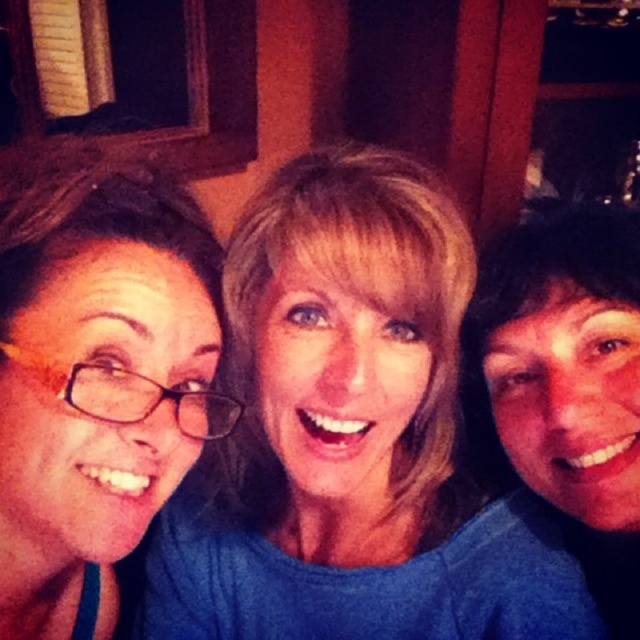
Based on the photo, can you confirm if yellow-framed glasses at left is smaller than matte blue shirt at center?

Indeed, yellow-framed glasses at left has a smaller size compared to matte blue shirt at center.

In the scene shown: Can you confirm if yellow-framed glasses at left is positioned to the right of matte blue shirt at center?

In fact, yellow-framed glasses at left is to the left of matte blue shirt at center.

Locate an element on the screen. This screenshot has height=640, width=640. yellow-framed glasses at left is located at coordinates (97, 378).

I want to click on yellow-framed glasses at left, so click(97, 378).

Is the position of blue fabric shirt at center less distant than that of matte blue shirt at center?

Yes, it is in front of matte blue shirt at center.

Does blue fabric shirt at center have a lesser width compared to matte blue shirt at center?

In fact, blue fabric shirt at center might be wider than matte blue shirt at center.

Measure the distance between blue fabric shirt at center and camera.

A distance of 20.36 inches exists between blue fabric shirt at center and camera.

Locate an element on the screen. blue fabric shirt at center is located at coordinates (349, 436).

Is blue fabric shirt at center positioned at the back of yellow-framed glasses at left?

No, blue fabric shirt at center is closer to the viewer.

Looking at this image, who is taller, blue fabric shirt at center or yellow-framed glasses at left?

With more height is blue fabric shirt at center.

What do you see at coordinates (349, 436) in the screenshot? This screenshot has height=640, width=640. I see `blue fabric shirt at center` at bounding box center [349, 436].

You are a GUI agent. You are given a task and a screenshot of the screen. Output one action in this format:
    pyautogui.click(x=<x>, y=<y>)
    Task: Click on the blue fabric shirt at center
    The image size is (640, 640).
    Given the screenshot: What is the action you would take?
    pyautogui.click(x=349, y=436)